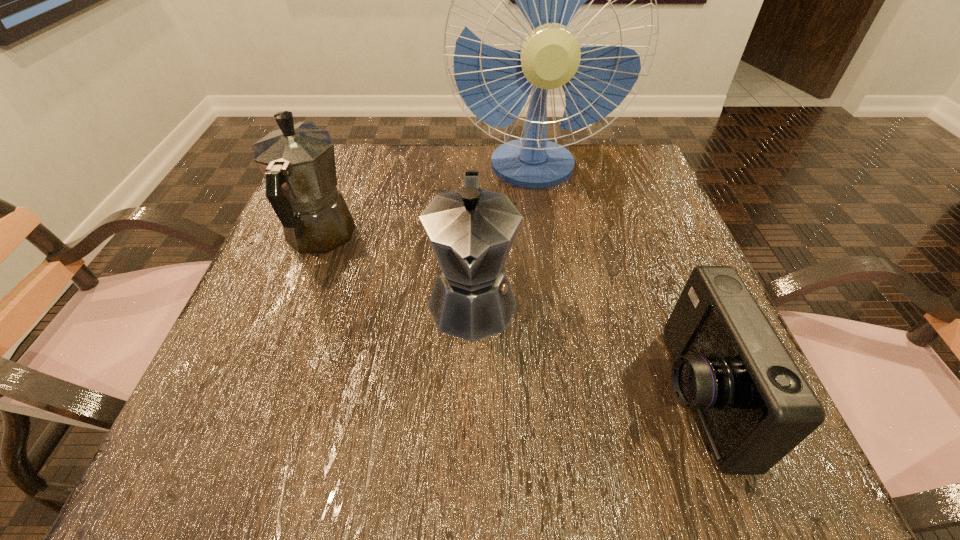
Find the location of a particular element. Image resolution: width=960 pixels, height=540 pixels. vacant space in between the leftmost object and the tallest object is located at coordinates (426, 203).

Identify the location of unoccupied position between the right coffeepot and the camera. The width and height of the screenshot is (960, 540). (583, 348).

The width and height of the screenshot is (960, 540). In order to click on object that is the third closest to the camera in this screenshot , I will do `click(298, 163)`.

The width and height of the screenshot is (960, 540). Find the location of `object that is the second closest to the fan`. object that is the second closest to the fan is located at coordinates (471, 231).